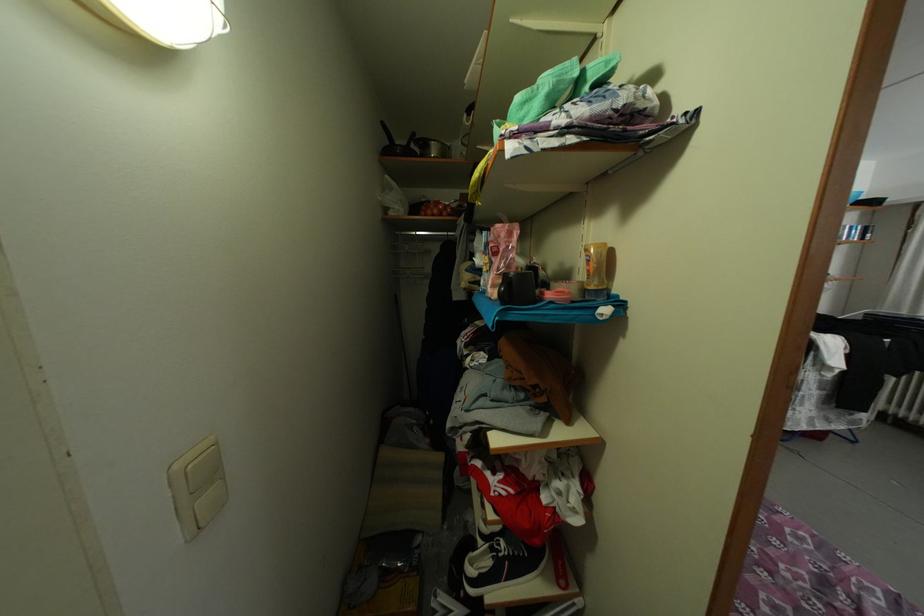
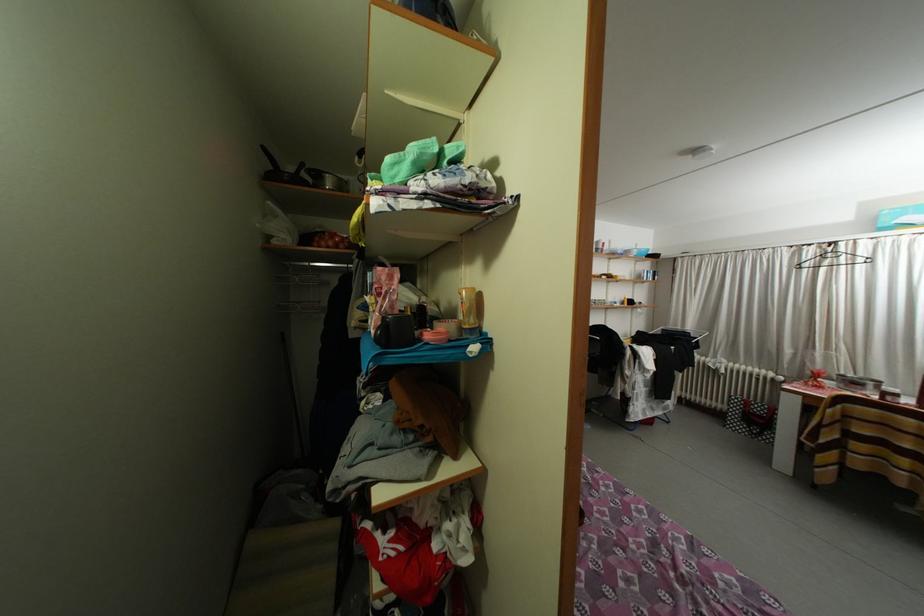
What movement of the cameraman would produce the second image?

The movement direction of the cameraman is right, backward.